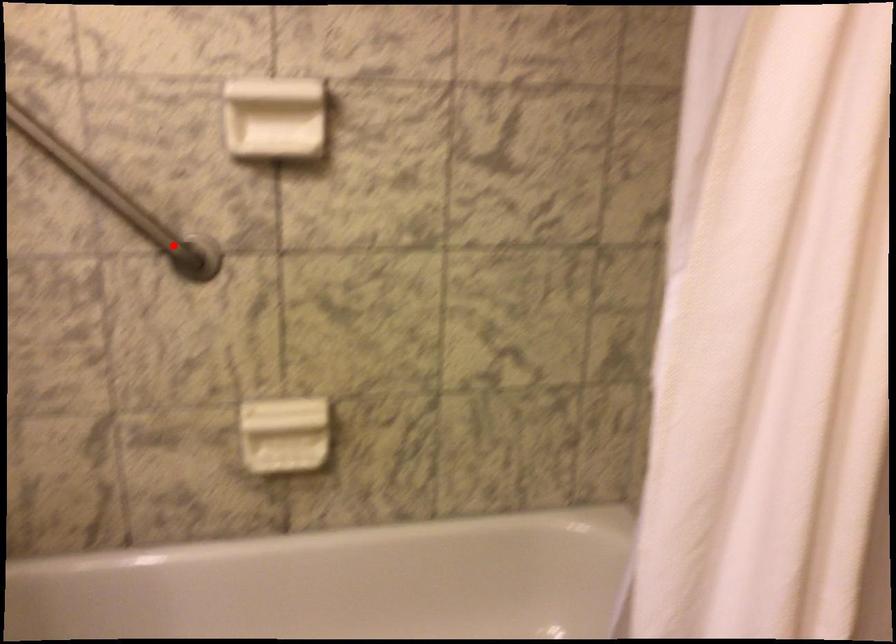
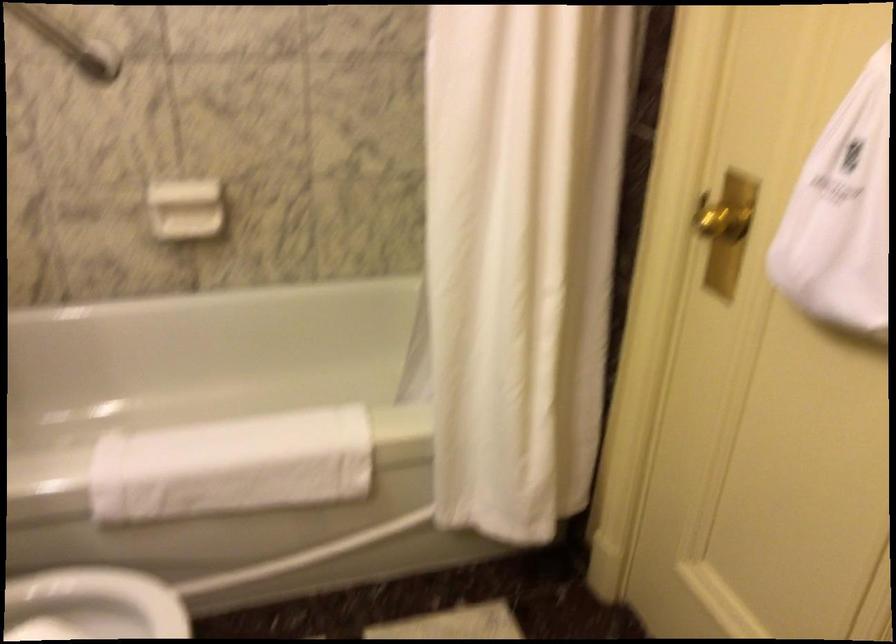
Question: I am providing you with two images of the same scene from different viewpoints. A red point is shown in image1. For the corresponding object point in image2, is it positioned nearer or farther from the camera?

Choices:
 (A) Nearer
 (B) Farther

Answer: (B)